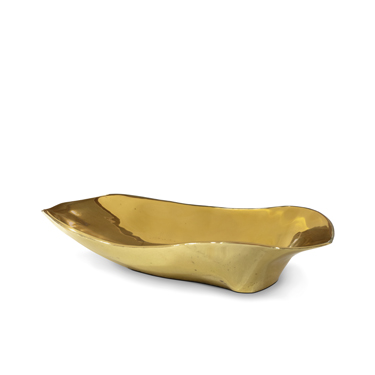
Locate an element on the screen. The image size is (375, 375). light is located at coordinates point(71,230).